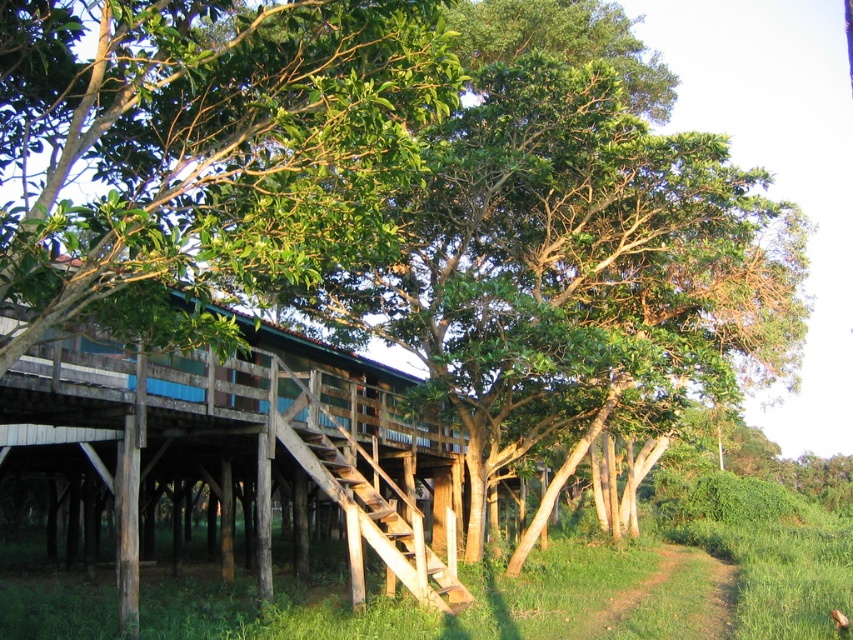
Question: Does wooden hut at center appear under wooden stairs at center?

Choices:
 (A) no
 (B) yes

Answer: (A)

Question: Which point is closer to the camera?

Choices:
 (A) green grassy path at lower right
 (B) wooden stairs at center
 (C) wooden hut at center

Answer: (C)

Question: Is green grassy path at lower right above wooden stairs at center?

Choices:
 (A) yes
 (B) no

Answer: (B)

Question: Among these points, which one is nearest to the camera?

Choices:
 (A) (717, 605)
 (B) (354, 500)
 (C) (262, 360)

Answer: (B)

Question: Is wooden hut at center to the left of green grassy path at lower right from the viewer's perspective?

Choices:
 (A) yes
 (B) no

Answer: (A)

Question: Which of the following is the farthest from the observer?

Choices:
 (A) (444, 602)
 (B) (61, 365)

Answer: (A)